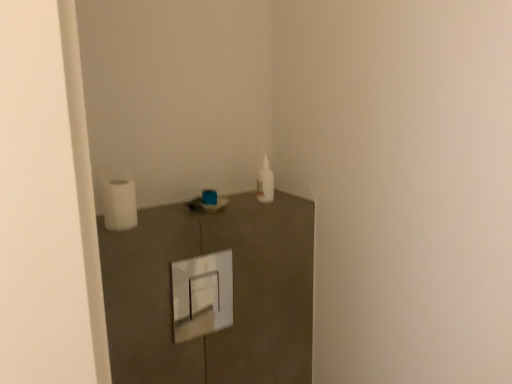
Question: Considering the relative positions of matte plastic sink at center and white matte toilet paper at left in the image provided, is matte plastic sink at center in front of white matte toilet paper at left?

Choices:
 (A) no
 (B) yes

Answer: (A)

Question: Is matte plastic sink at center taller than white matte toilet paper at left?

Choices:
 (A) yes
 (B) no

Answer: (B)

Question: Considering the relative positions of matte plastic sink at center and white matte toilet paper at left in the image provided, is matte plastic sink at center behind white matte toilet paper at left?

Choices:
 (A) yes
 (B) no

Answer: (A)

Question: From a real-world perspective, is matte plastic sink at center positioned under white matte toilet paper at left based on gravity?

Choices:
 (A) no
 (B) yes

Answer: (B)

Question: Is matte plastic sink at center oriented away from white matte toilet paper at left?

Choices:
 (A) no
 (B) yes

Answer: (A)

Question: Considering the relative sizes of matte plastic sink at center and white matte toilet paper at left in the image provided, is matte plastic sink at center smaller than white matte toilet paper at left?

Choices:
 (A) no
 (B) yes

Answer: (A)

Question: Can you confirm if white matte toilet paper at left is thinner than matte plastic sink at center?

Choices:
 (A) yes
 (B) no

Answer: (A)

Question: Does white matte toilet paper at left have a greater height compared to matte plastic sink at center?

Choices:
 (A) no
 (B) yes

Answer: (B)

Question: From a real-world perspective, does white matte toilet paper at left stand above matte plastic sink at center?

Choices:
 (A) yes
 (B) no

Answer: (A)

Question: Considering the relative sizes of white matte toilet paper at left and matte plastic sink at center in the image provided, is white matte toilet paper at left bigger than matte plastic sink at center?

Choices:
 (A) no
 (B) yes

Answer: (A)

Question: From a real-world perspective, is white matte toilet paper at left beneath matte plastic sink at center?

Choices:
 (A) yes
 (B) no

Answer: (B)

Question: Is white matte toilet paper at left touching matte plastic sink at center?

Choices:
 (A) no
 (B) yes

Answer: (A)

Question: Is matte plastic sink at center bigger or smaller than white matte toilet paper at left?

Choices:
 (A) small
 (B) big

Answer: (B)